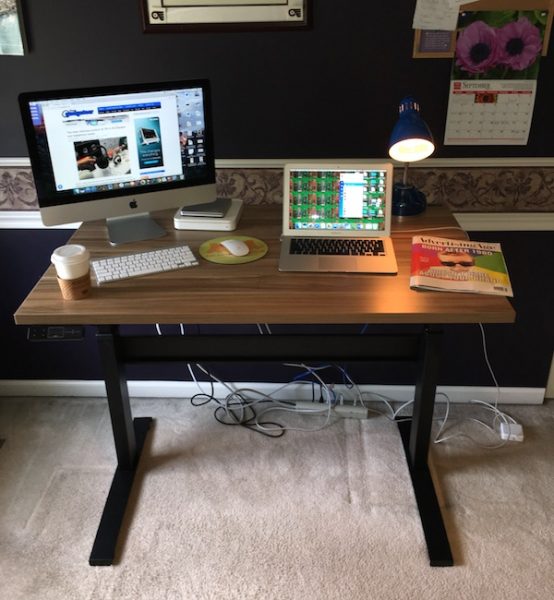
You are a GUI agent. You are given a task and a screenshot of the screen. Output one action in this format:
    pyautogui.click(x=<x>, y=<y>)
    Task: Click on the cords
    
    Given the screenshot: What is the action you would take?
    pyautogui.click(x=217, y=390)